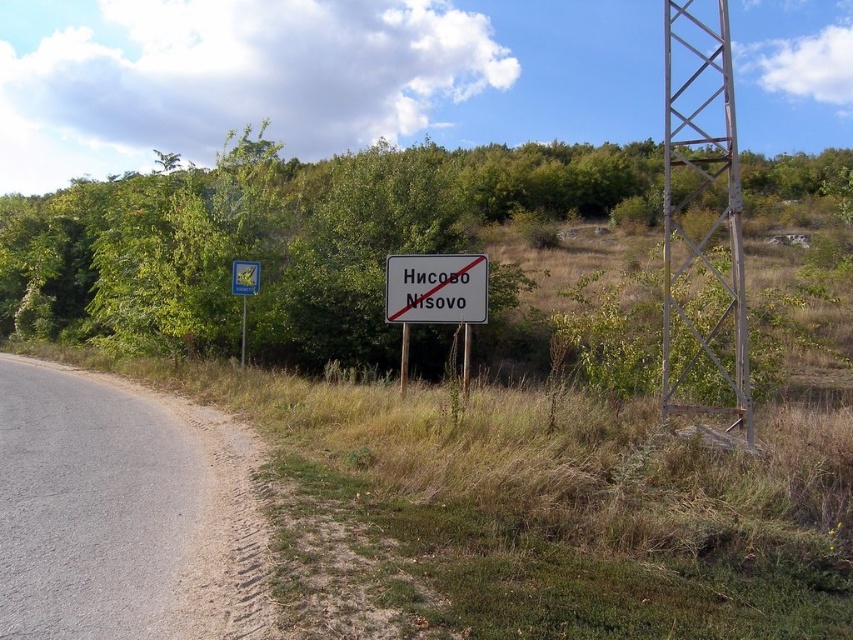
Question: Can you confirm if green leafy tree at center is thinner than brushed metal sign at left?

Choices:
 (A) yes
 (B) no

Answer: (B)

Question: Which point is closer to the camera?

Choices:
 (A) (697, 74)
 (B) (256, 275)
 (C) (328, 337)
 (D) (450, 264)

Answer: (D)

Question: Where is green leafy tree at center located in relation to gray metallic sign at center in the image?

Choices:
 (A) left
 (B) right

Answer: (A)

Question: Which of the following is the closest to the observer?

Choices:
 (A) [701, 90]
 (B) [90, 304]
 (C) [242, 294]

Answer: (C)

Question: Does green leafy tree at center have a larger size compared to gray metallic sign at center?

Choices:
 (A) yes
 (B) no

Answer: (A)

Question: Which is farther from the metallic reflective sign at left?

Choices:
 (A) brushed metal sign at left
 (B) metallic tower at right
 (C) gray metallic sign at center

Answer: (B)